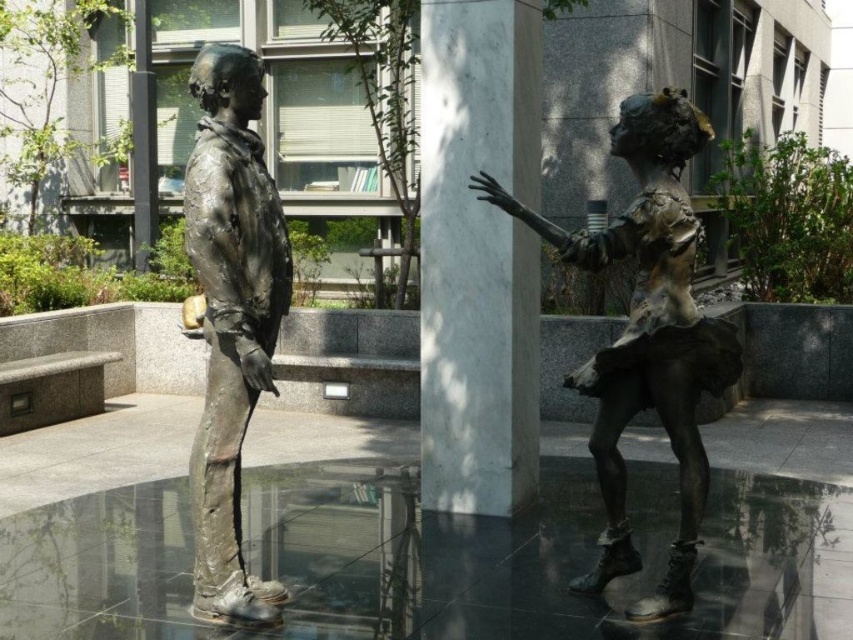
Is bronze textured ballerina at center bigger than bronze statue at center?

Correct, bronze textured ballerina at center is larger in size than bronze statue at center.

Which of these two, bronze textured ballerina at center or bronze statue at center, stands taller?

Standing taller between the two is bronze statue at center.

Which is behind, point (705, 456) or point (227, 236)?

Positioned behind is point (705, 456).

What are the coordinates of `bronze textured ballerina at center` in the screenshot? It's located at (646, 333).

Is white marble pillar at center below bronze textured ballerina at center?

No, white marble pillar at center is not below bronze textured ballerina at center.

Where is `white marble pillar at center`? Image resolution: width=853 pixels, height=640 pixels. white marble pillar at center is located at coordinates (479, 256).

You are a GUI agent. You are given a task and a screenshot of the screen. Output one action in this format:
    pyautogui.click(x=<x>, y=<y>)
    Task: Click on the white marble pillar at center
    
    Given the screenshot: What is the action you would take?
    pyautogui.click(x=479, y=256)

Is white marble pillar at center wider than bronze statue at center?

Correct, the width of white marble pillar at center exceeds that of bronze statue at center.

Is point (463, 33) farther from viewer compared to point (198, 589)?

Yes.

Is point (471, 198) positioned before point (234, 129)?

That is False.

Locate an element on the screen. This screenshot has height=640, width=853. white marble pillar at center is located at coordinates (479, 256).